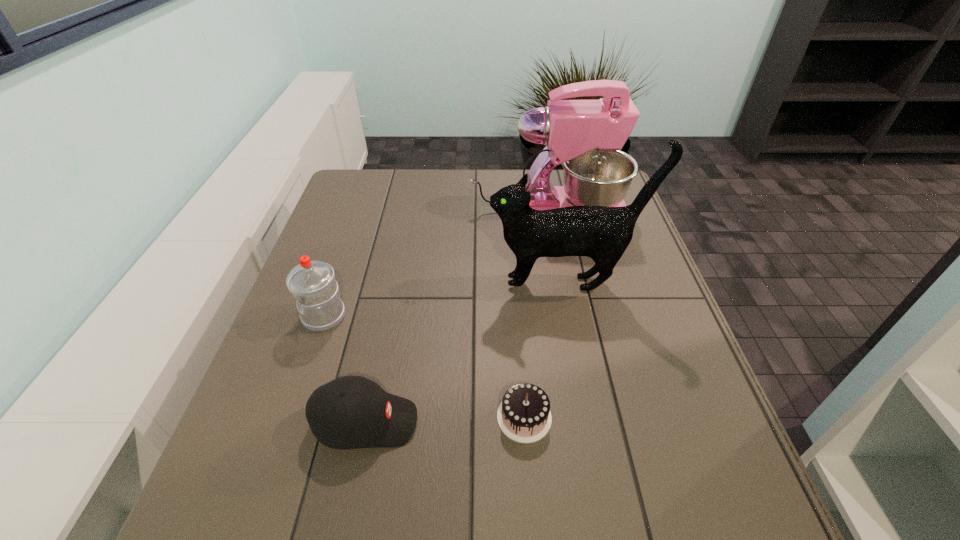
Find the location of a particular element. The image size is (960, 540). free space between the shortest object and the baseball cap is located at coordinates (444, 420).

Identify which object is the closest to the fourth nearest object. Please provide its 2D coordinates. Your answer should be formatted as a tuple, i.e. [(x, y)], where the tuple contains the x and y coordinates of a point satisfying the conditions above.

[(585, 136)]

This screenshot has height=540, width=960. Identify the location of the closest object to the mixer. (602, 233).

Locate an element on the screen. vacant space that satisfies the following two spatial constraints: 1. on the front side of the shortest object; 2. with a logo on the front of the fourth tallest object is located at coordinates (524, 422).